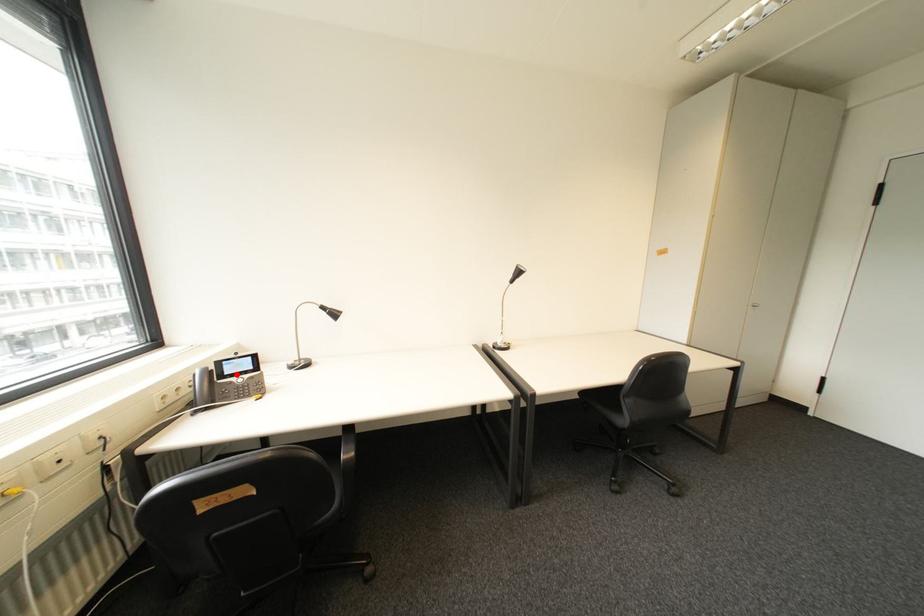
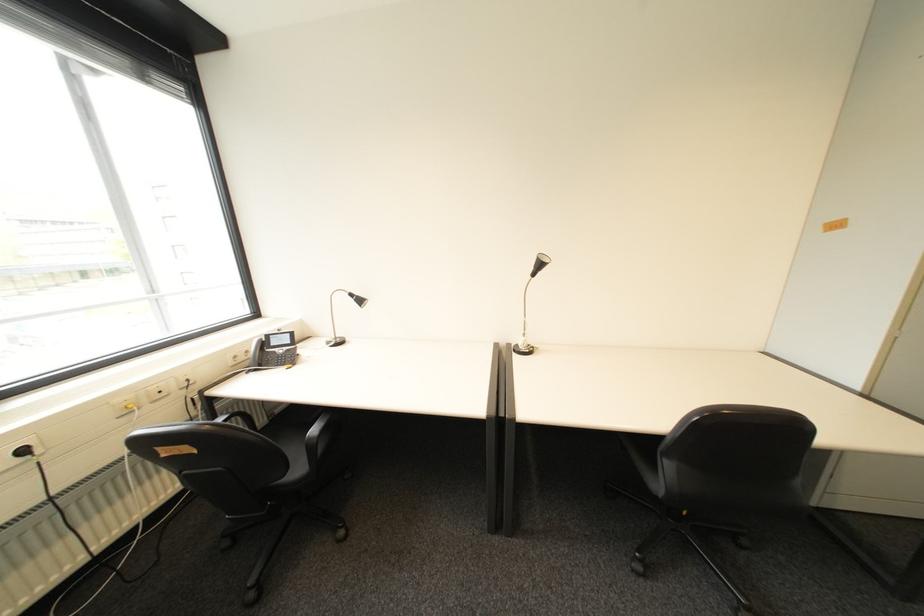
In the second image, find the point that corresponds to the highlighted location in the first image.

(283, 345)